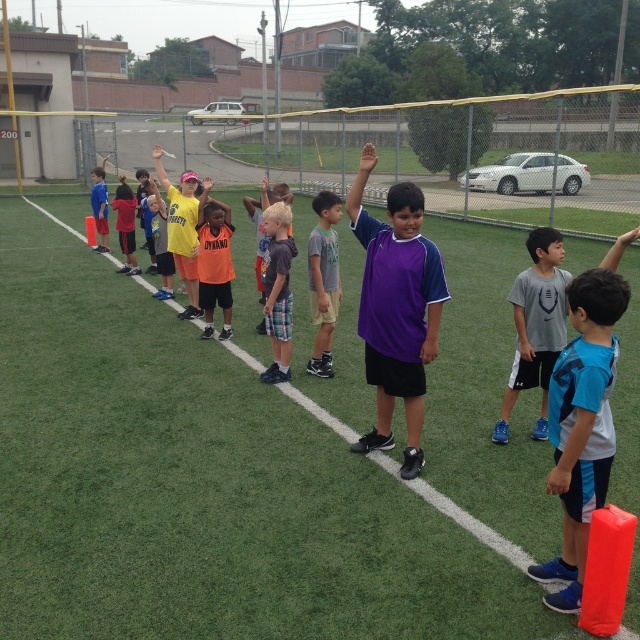
You are a photographer standing at the edge of the field. You want to take a photo that includes both the point at (364, 337) and the point at (172, 216). Which point should you focus on first to ensure both are in sharp focus?

You should focus on the point at (172, 216) first because it is farther from the camera than the point at (364, 337). By focusing on the farther point, the closer point will also be within the depth of field, ensuring both are in sharp focus.

You are a coach observing the children on the field. You notice two children wearing the purple jersey at center and yellow matte shirt at center. Which child is positioned lower in the image?

The purple jersey at center is located below the yellow matte shirt at center, so the child wearing the purple jersey at center is positioned lower in the image.

You are a coach observing the children on the field. You notice two children wearing an orange jersey at center and a yellow matte shirt at center. Which child is standing to the right of the other?

The orange jersey at center is positioned on the right side of yellow matte shirt at center, so the child wearing the orange jersey at center is standing to the right of the child in the yellow matte shirt at center.